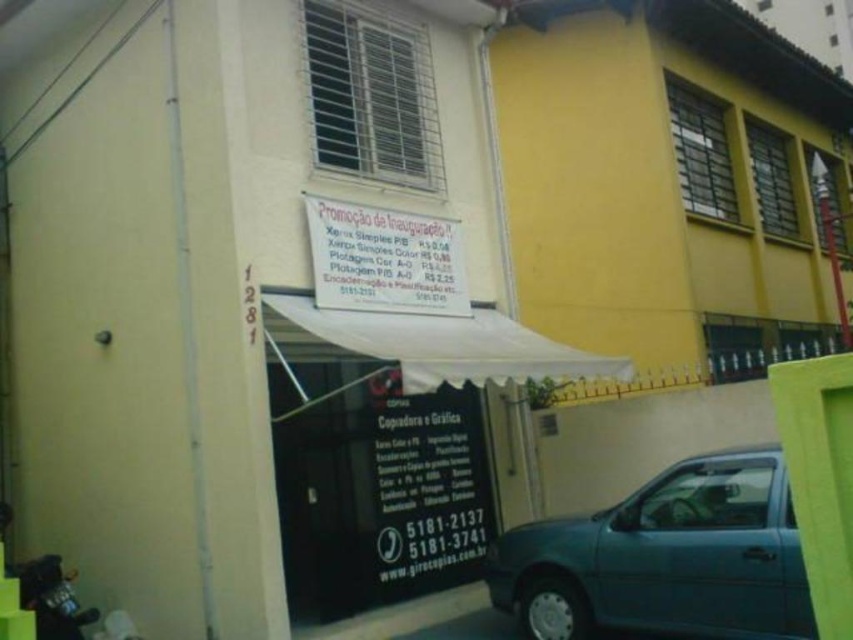
You are standing in front of the building and want to park your teal metallic car at lower right. The white fabric canopy at center is blocking your way. Can you drive around the canopy to the left?

The teal metallic car at lower right is already positioned to the right of the white fabric canopy at center, so you can park it there without needing to drive around the canopy.

You are standing in front of the building and want to read the text on the black paperboard at center. Can you comfortably read the text from your current position?

The black paperboard at center is 19.05 feet away from the viewer. Since this distance is typical for reading signs, you should be able to comfortably read the text from your current position.

You are standing at the entrance of the building and want to park your teal metallic car at lower right. If the parking spot is located at coordinate point 0.872, 0.781, will your car fit perfectly in that spot?

The teal metallic car at lower right is already positioned exactly at the coordinate point (665, 557), so it fits perfectly in that parking spot.